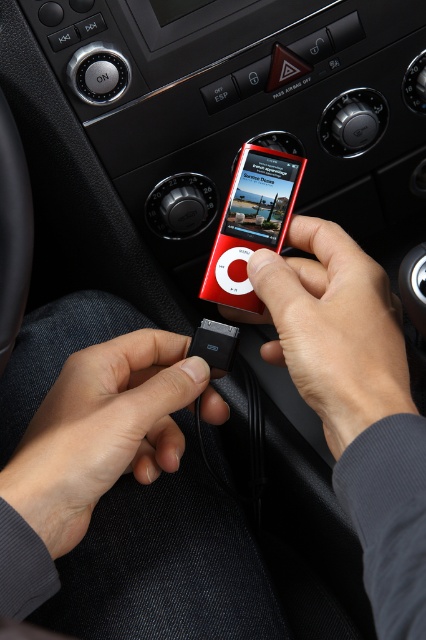
Who is positioned more to the right, black matte usb cable at lower center or matte red ipod at center?

From the viewer's perspective, matte red ipod at center appears more on the right side.

Identify the location of black matte usb cable at lower center. (104, 429).

Where is `black matte usb cable at lower center`? The height and width of the screenshot is (640, 426). black matte usb cable at lower center is located at coordinates (104, 429).

Can you confirm if black matte usb cable at lower center is bigger than red glossy ipod at center?

Yes.

Does black matte usb cable at lower center have a greater width compared to red glossy ipod at center?

Yes, black matte usb cable at lower center is wider than red glossy ipod at center.

This screenshot has height=640, width=426. I want to click on black matte usb cable at lower center, so click(x=104, y=429).

The image size is (426, 640). Identify the location of black matte usb cable at lower center. (104, 429).

Is the position of matte red ipod at center less distant than that of red glossy ipod at center?

Yes, matte red ipod at center is in front of red glossy ipod at center.

Can you confirm if matte red ipod at center is smaller than red glossy ipod at center?

No, matte red ipod at center is not smaller than red glossy ipod at center.

Where is `matte red ipod at center`? Image resolution: width=426 pixels, height=640 pixels. matte red ipod at center is located at coordinates tap(331, 328).